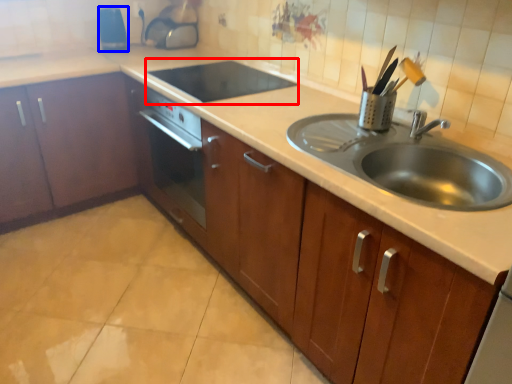
Question: Which object is further to the camera taking this photo, appliance (highlighted by a red box) or appliance (highlighted by a blue box)?

Choices:
 (A) appliance
 (B) appliance

Answer: (B)